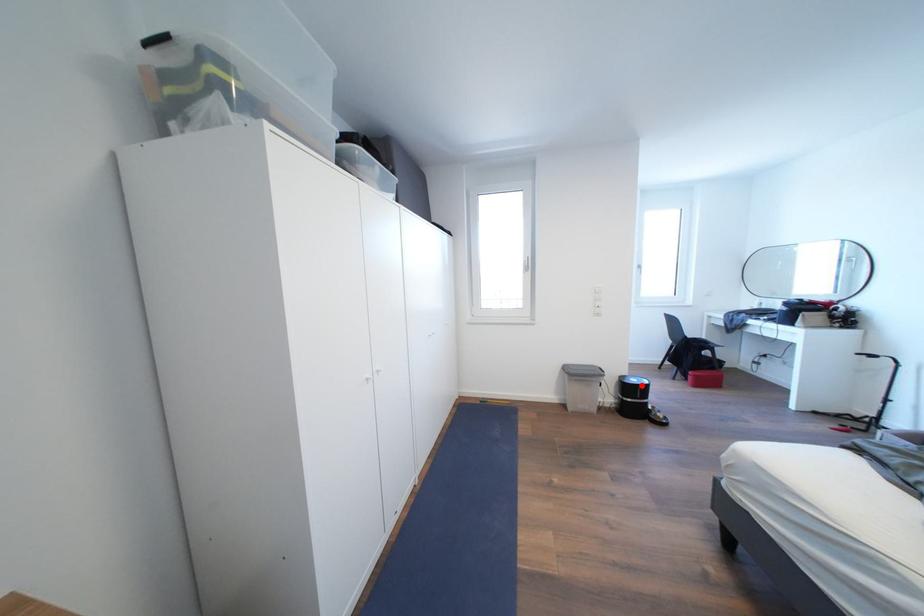
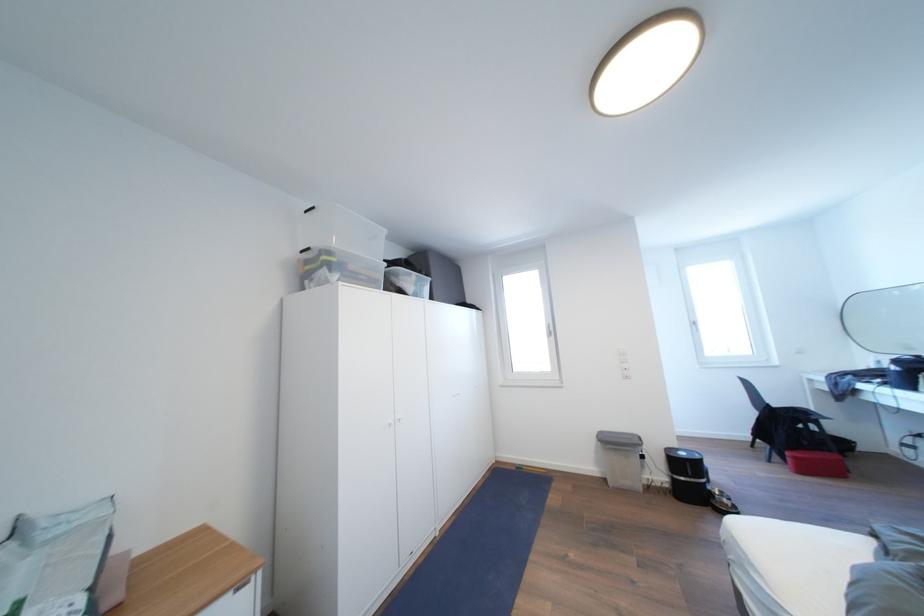
Question: I am providing you with two images of the same scene from different viewpoints. Image1 has a red point marked. In image2, the corresponding 3D location appears at what relative position? Reply with the corresponding letter.

Choices:
 (A) Closer
 (B) Farther

Answer: (A)